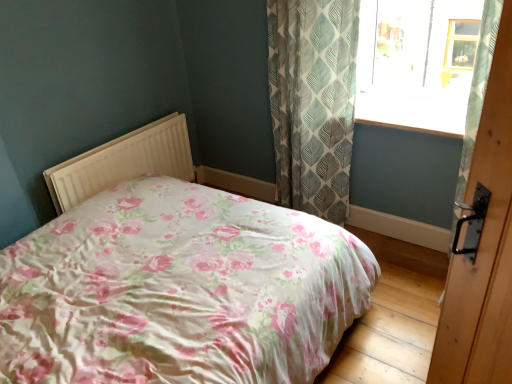
At what (x,y) coordinates should I click in order to perform the action: click on free space above white plastic radiator at center (from a real-world perspective). Please return your answer as a coordinate pair (x, y). This screenshot has height=384, width=512. Looking at the image, I should click on (122, 139).